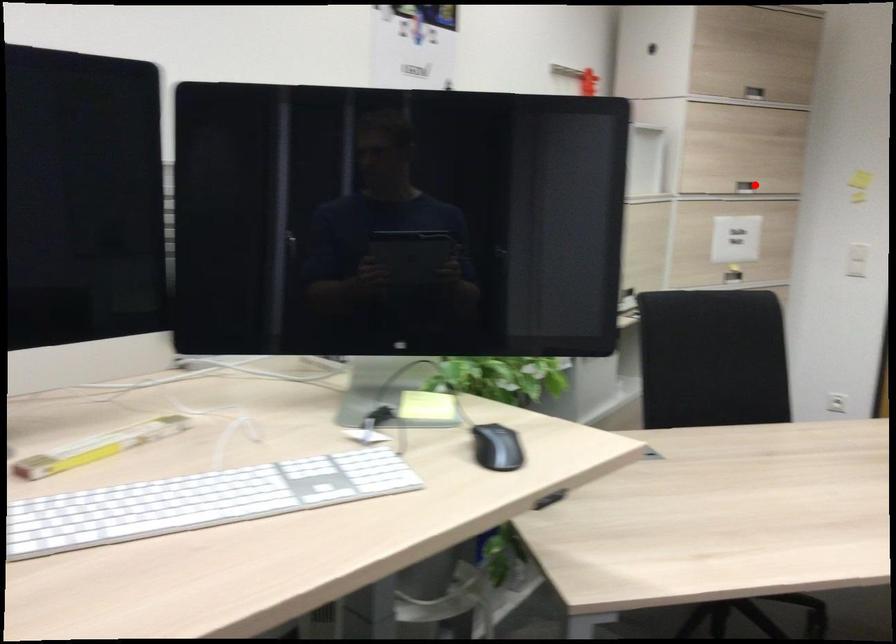
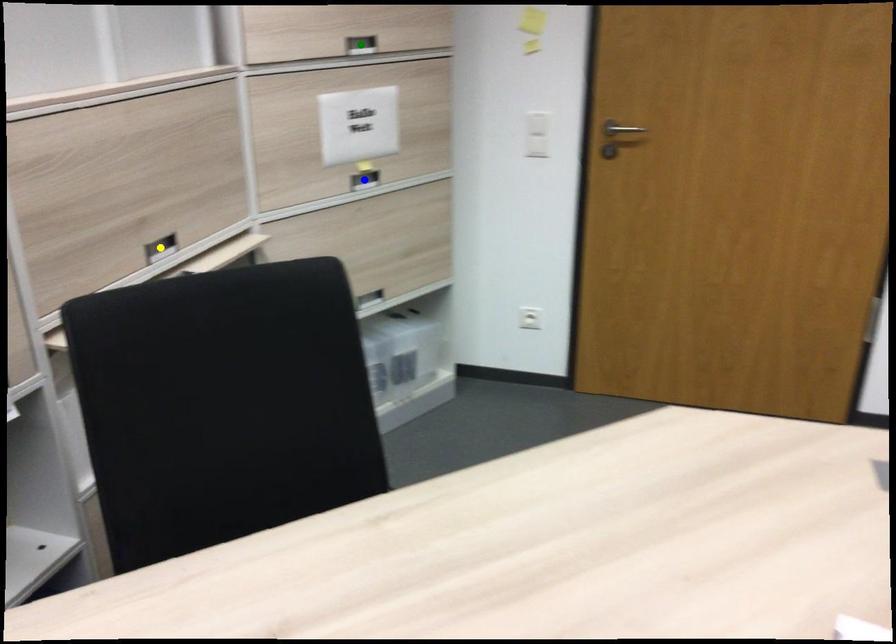
Question: I am providing you with two images of the same scene from different viewpoints. A red point is marked on the first image. You are given multiple points on the second image. Which point in image 2 represents the same 3d spot as the red point in image 1?

Choices:
 (A) yellow point
 (B) blue point
 (C) green point

Answer: (C)